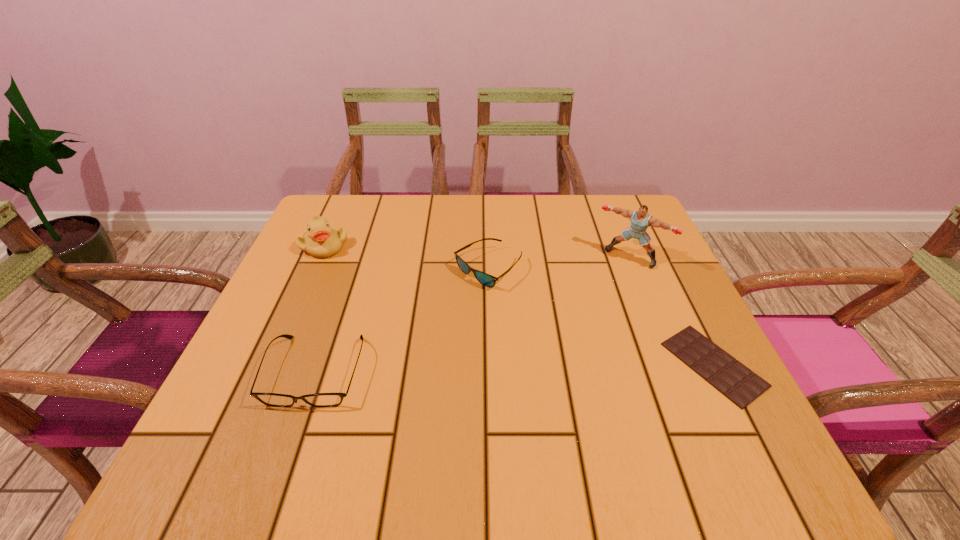
In the image, there is a desktop. Find the location of `vacant space at the right edge`. vacant space at the right edge is located at coordinates point(602,258).

Identify the location of vacant region at the far left corner. The height and width of the screenshot is (540, 960). (353, 232).

Where is `blank space at the far right corner`? The image size is (960, 540). blank space at the far right corner is located at coordinates (588, 211).

Locate an element on the screen. The image size is (960, 540). vacant space at the near right corner of the desktop is located at coordinates (661, 389).

Find the location of a particular element. The height and width of the screenshot is (540, 960). empty location between the tallest object and the chocolate bar is located at coordinates pos(672,310).

Where is `vacant point located between the second tallest object and the third object from right to left`? The height and width of the screenshot is (540, 960). vacant point located between the second tallest object and the third object from right to left is located at coordinates (406, 257).

Identify the location of free spot between the shortest object and the spectacles. Image resolution: width=960 pixels, height=540 pixels. (515, 368).

In order to click on vacant space that is in between the duckling and the sunglasses in this screenshot , I will do `click(406, 257)`.

Identify the location of vacant area that lies between the third object from right to left and the shortest object. (601, 316).

The width and height of the screenshot is (960, 540). What are the coordinates of `free space between the chocolate bar and the tallest object` in the screenshot? It's located at (672, 310).